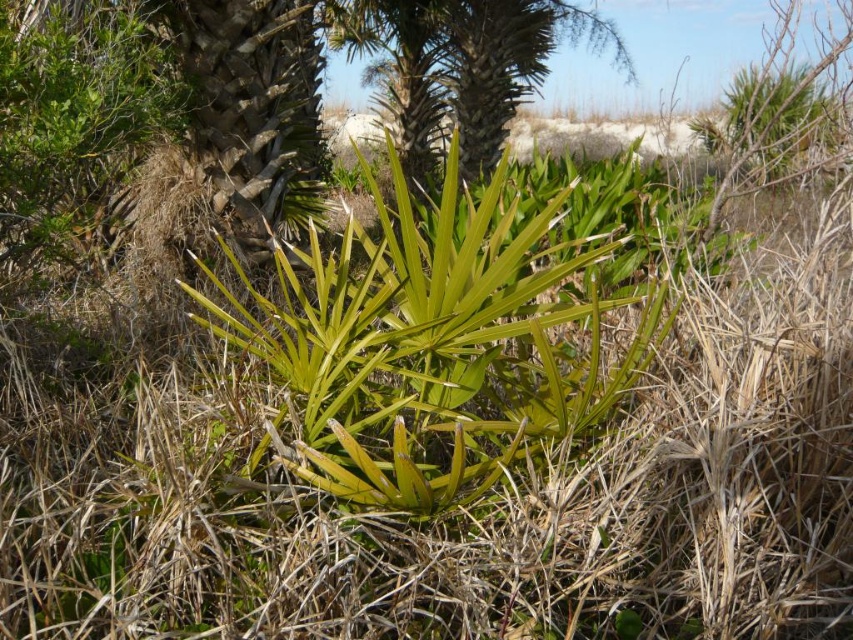
Based on the scene description, what can be found at the coordinates point (x=430, y=348)?

At point (x=430, y=348) lies green leafy plant at center.